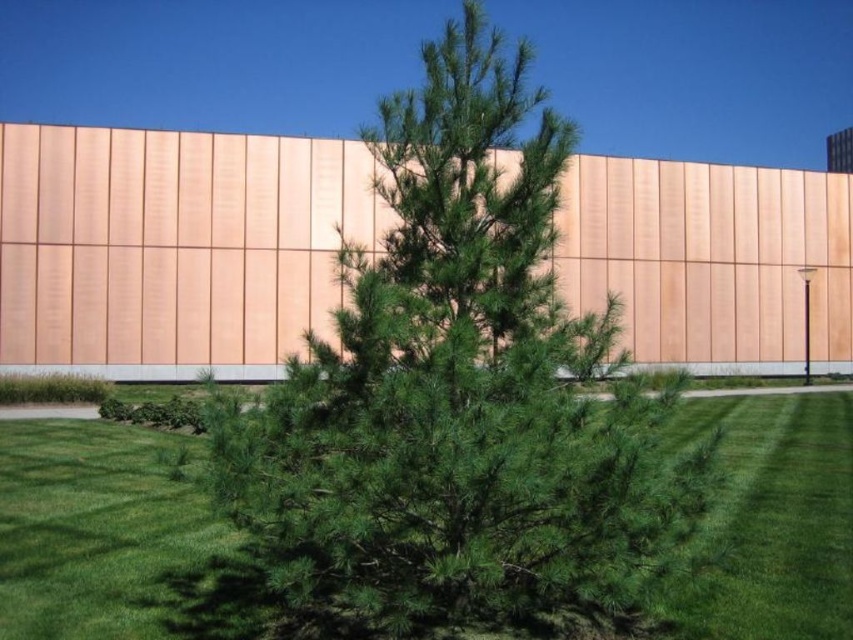
You are standing in the park and see the pine tree with its dense canopy. There is a specific point on the tree at coordinates point (x=459, y=396). What is the color and texture of the surface at this point?

The point (x=459, y=396) corresponds to the green needle like at center, which has a dense canopy of dark green needles forming a conical shape. The surface at this point is dark green and has a needle like texture.